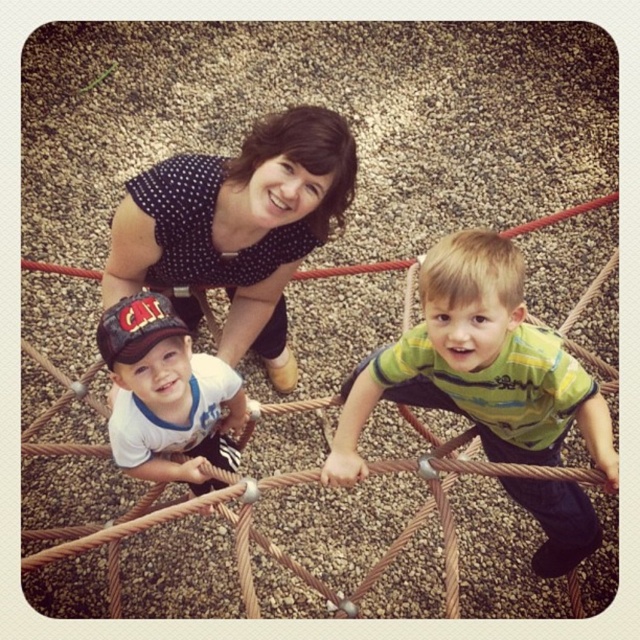
You are a photographer trying to capture a closeup of the polka dot fabric at upper center and the matte black cap at center. Which object should you focus on first if you want to ensure both are in focus?

The matte black cap at center is closer to the camera than the polka dot fabric at upper center, so you should focus on the matte black cap at center first to ensure both are in focus.

Consider the image. You are a parent trying to ensure the safety of your children playing at the playground. You see the brown rope bridge at center and the matte black cap at center. Which object is located to the right of the other?

The brown rope bridge at center is positioned on the right side of matte black cap at center.